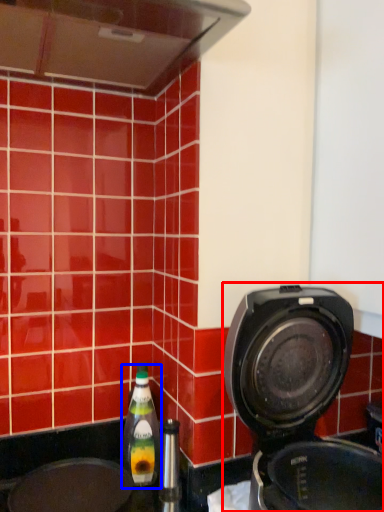
Question: Which of the following is the farthest to the observer, home appliance (highlighted by a red box) or bottle (highlighted by a blue box)?

Choices:
 (A) home appliance
 (B) bottle

Answer: (B)